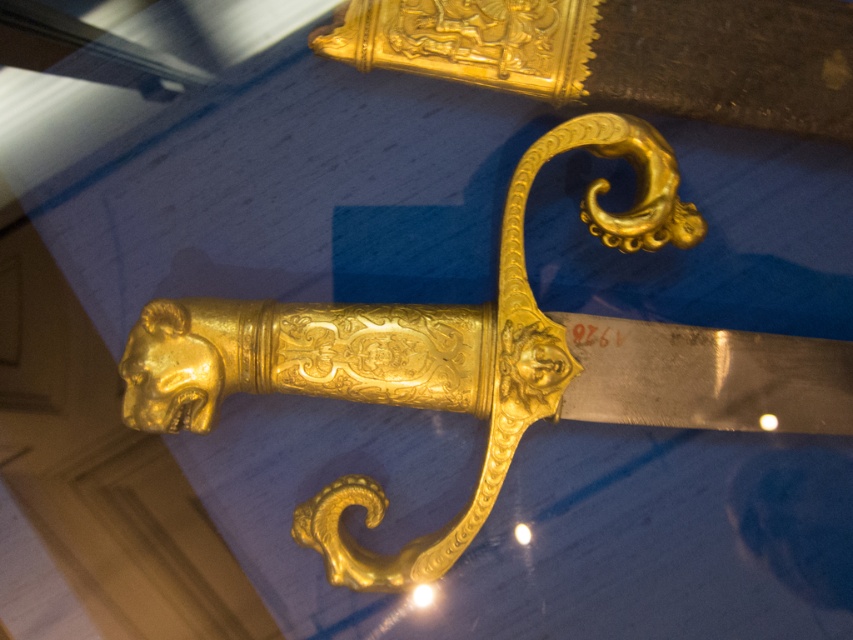
Does point (595, 355) come in front of point (653, 106)?

No, it is not.

Can you confirm if gold polished sword at center is wider than gold polished sword at upper center?

Yes, gold polished sword at center is wider than gold polished sword at upper center.

Does point (769, 371) come behind point (606, 67)?

That is True.

You are a GUI agent. You are given a task and a screenshot of the screen. Output one action in this format:
    pyautogui.click(x=<x>, y=<y>)
    Task: Click on the gold polished sword at center
    
    Given the screenshot: What is the action you would take?
    pyautogui.click(x=486, y=360)